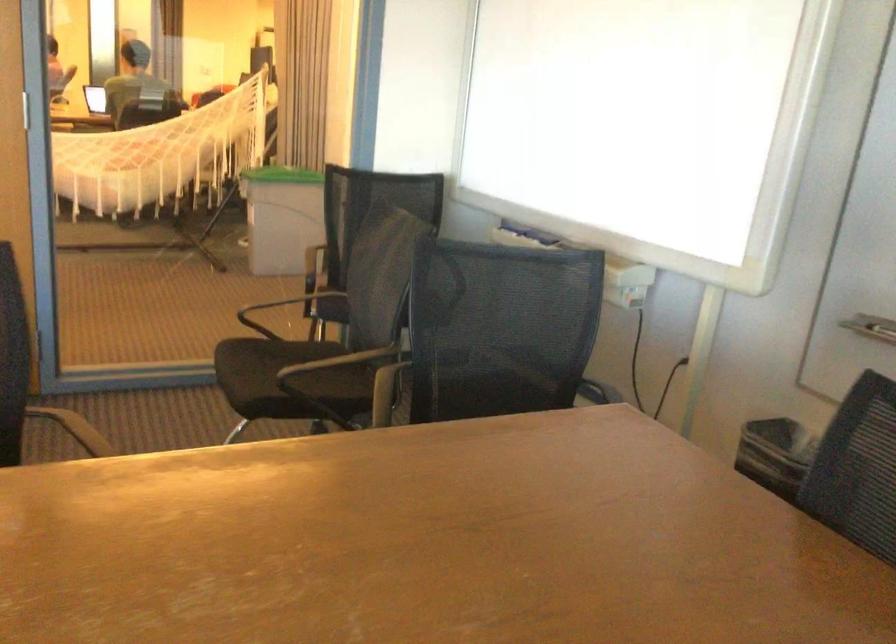
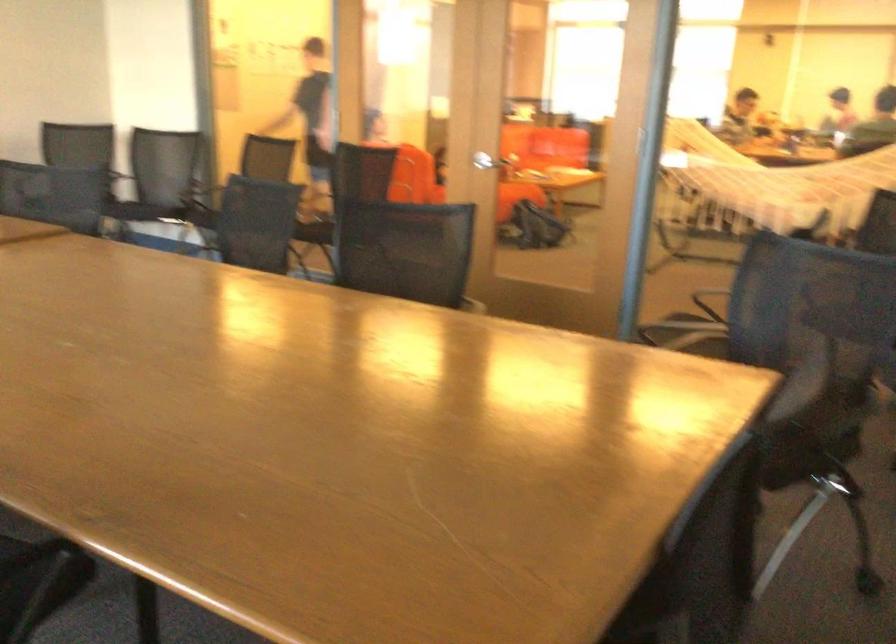
Find the pixel in the second image that matches point 102,151 in the first image.

(778, 182)